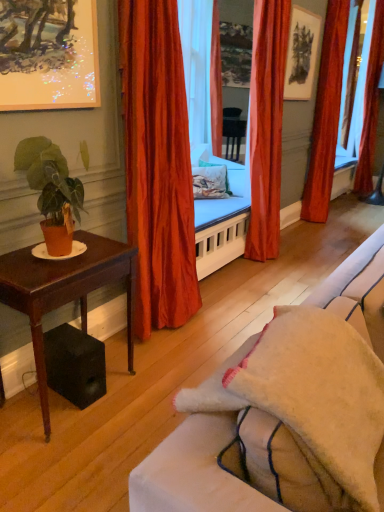
Question: From a real-world perspective, is velvet orange curtain at center, the third curtain from the right, above or below matte orange pot at left?

Choices:
 (A) above
 (B) below

Answer: (A)

Question: From the image's perspective, is velvet orange curtain at center, placed as the second curtain when sorted from front to back, located above or below matte orange pot at left?

Choices:
 (A) above
 (B) below

Answer: (A)

Question: Which object is positioned farthest from the beige fabric couch at center?

Choices:
 (A) matte orange pot at left
 (B) floral fabric pillow at center
 (C) velvet orange curtain at center, the second curtain when ordered from left to right
 (D) satin orange curtain at center, acting as the fourth curtain starting from the right
 (E) transparent glass window screen at right

Answer: (E)

Question: Which is farther from the matte orange pot at left?

Choices:
 (A) velvet orange curtain at right, the fourth curtain when ordered from left to right
 (B) velvet orange curtain at center, which appears as the second curtain when viewed from the right
 (C) transparent glass window screen at right
 (D) matte black picture frame at upper center, the second picture frame from the left
 (E) metallic silver picture frame at upper left, the second picture frame from the right

Answer: (A)